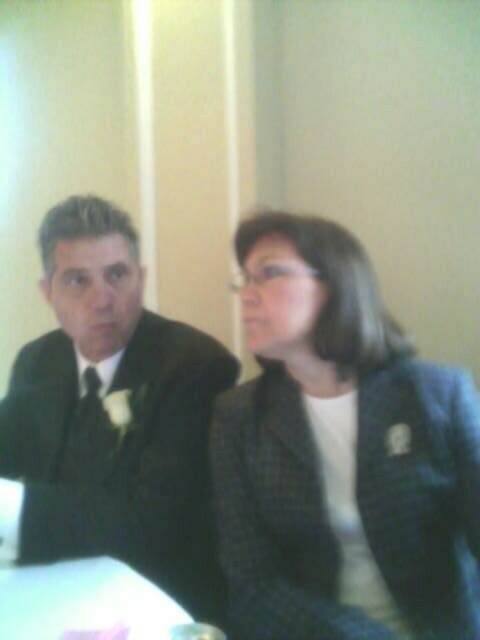
Question: Which point is closer to the camera taking this photo?

Choices:
 (A) (309, 408)
 (B) (167, 538)

Answer: (A)

Question: Is dark gray textured blazer at center to the left of matte black suit at left from the viewer's perspective?

Choices:
 (A) yes
 (B) no

Answer: (B)

Question: Is dark gray textured blazer at center positioned before matte black suit at left?

Choices:
 (A) yes
 (B) no

Answer: (A)

Question: Can you confirm if dark gray textured blazer at center is positioned below matte black suit at left?

Choices:
 (A) yes
 (B) no

Answer: (B)